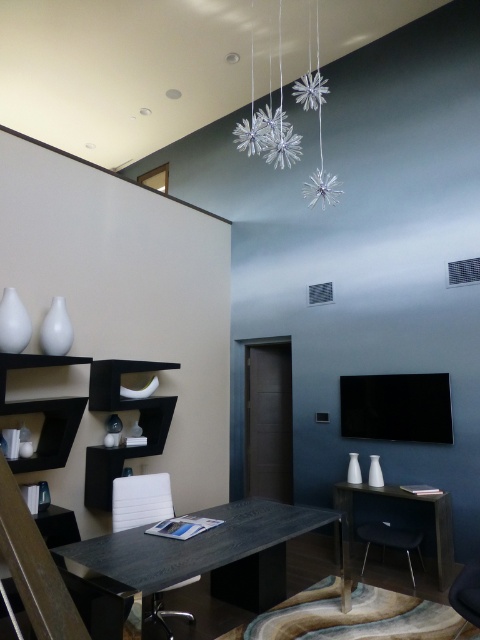
You are a delivery person standing at the entrance of the room. You need to place a package that requires a stable surface 2 meters away from the entrance. Is the black wood table at center suitable for placing the package?

The black wood table at center is 2.12 meters away from the camera, so yes, it is suitable for placing the package as it meets the required distance of 2 meters.

You are standing in the room and want to place a decorative item on the closest object to you between the black wood table at center and the silver metallic snowflake at upper center. Which object should you choose?

The black wood table at center is closer to the viewer than the silver metallic snowflake at upper center, so you should place the decorative item on the black wood table at center.